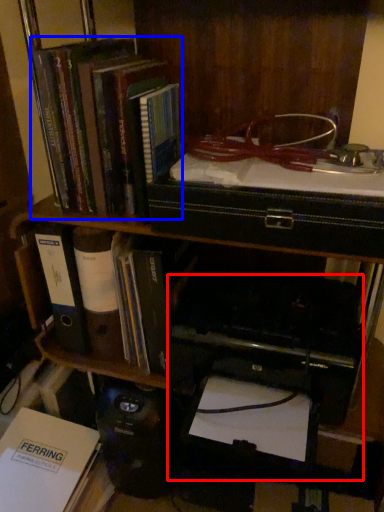
Question: Which of the following is the farthest to the observer, printer (highlighted by a red box) or book (highlighted by a blue box)?

Choices:
 (A) printer
 (B) book

Answer: (A)